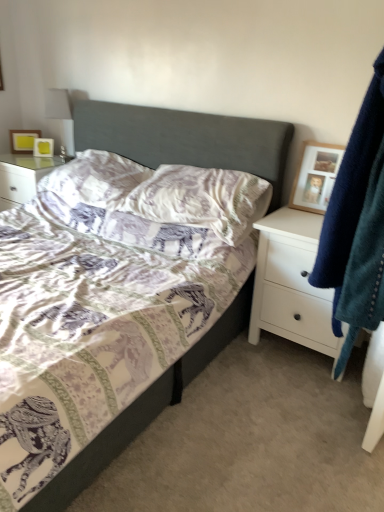
Question: From the image's perspective, does matte yellow picture frame at upper left, the 3th picture frame in the bottom-to-top sequence, appear lower than purple elephant-patterned pillow at center, arranged as the second pillow when viewed from the left?

Choices:
 (A) no
 (B) yes

Answer: (A)

Question: Does matte yellow picture frame at upper left, the first picture frame positioned from the back, have a lesser height compared to purple elephant-patterned pillow at center, the first pillow positioned from the right?

Choices:
 (A) yes
 (B) no

Answer: (A)

Question: Can you confirm if matte yellow picture frame at upper left, the 1th picture frame in the top-to-bottom sequence, is smaller than purple elephant-patterned pillow at center, arranged as the second pillow when viewed from the left?

Choices:
 (A) no
 (B) yes

Answer: (B)

Question: Would you say matte yellow picture frame at upper left, the first picture frame positioned from the back, contains purple elephant-patterned pillow at center, arranged as the second pillow when viewed from the left?

Choices:
 (A) yes
 (B) no

Answer: (B)

Question: Is matte yellow picture frame at upper left, the first picture frame positioned from the back, completely or partially outside of purple elephant-patterned pillow at center, arranged as the second pillow when viewed from the left?

Choices:
 (A) no
 (B) yes

Answer: (B)

Question: From the image's perspective, is velvety blue robe at right positioned above or below white matte chest of drawers at right?

Choices:
 (A) above
 (B) below

Answer: (A)

Question: Would you say velvety blue robe at right is to the left or to the right of white matte chest of drawers at right in the picture?

Choices:
 (A) left
 (B) right

Answer: (B)

Question: Based on their sizes in the image, would you say velvety blue robe at right is bigger or smaller than white matte chest of drawers at right?

Choices:
 (A) small
 (B) big

Answer: (A)

Question: Is velvety blue robe at right wider or thinner than white matte chest of drawers at right?

Choices:
 (A) thin
 (B) wide

Answer: (A)

Question: From the image's perspective, is white matte chest of drawers at right above or below wooden picture frame at upper right, which is the third picture frame from left to right?

Choices:
 (A) above
 (B) below

Answer: (B)

Question: Would you say white matte chest of drawers at right is to the left or to the right of wooden picture frame at upper right, which is the 1th picture frame in right-to-left order, in the picture?

Choices:
 (A) right
 (B) left

Answer: (B)

Question: Is point (299, 223) closer or farther from the camera than point (301, 187)?

Choices:
 (A) closer
 (B) farther

Answer: (A)

Question: From a real-world perspective, relative to wooden picture frame at upper right, which is the third picture frame from left to right, is white matte chest of drawers at right vertically above or below?

Choices:
 (A) above
 (B) below

Answer: (B)

Question: From a real-world perspective, is wooden picture frame at upper right, marked as the first picture frame in a bottom-to-top arrangement, positioned above or below purple elephant-patterned pillow at center, the first pillow positioned from the right?

Choices:
 (A) below
 (B) above

Answer: (B)

Question: Considering their positions, is wooden picture frame at upper right, acting as the third picture frame starting from the back, located in front of or behind purple elephant-patterned pillow at center, the first pillow positioned from the right?

Choices:
 (A) front
 (B) behind

Answer: (B)